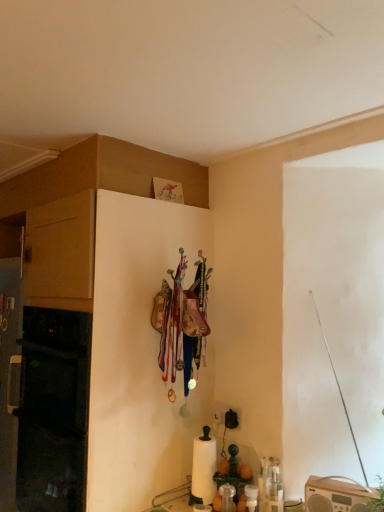
What are the coordinates of `green leafy plant at lower right` in the screenshot? It's located at (378, 498).

Describe the element at coordinates (378, 498) in the screenshot. This screenshot has width=384, height=512. I see `green leafy plant at lower right` at that location.

What do you see at coordinates (102, 175) in the screenshot?
I see `matte wood cabinet at left` at bounding box center [102, 175].

The width and height of the screenshot is (384, 512). What are the coordinates of `matte wood cabinet at left` in the screenshot? It's located at (102, 175).

This screenshot has width=384, height=512. What are the coordinates of `green leafy plant at lower right` in the screenshot? It's located at (378, 498).

Does green leafy plant at lower right appear on the right side of matte wood cabinet at left?

Correct, you'll find green leafy plant at lower right to the right of matte wood cabinet at left.

In the scene shown: Which object is closer to the camera, green leafy plant at lower right or matte wood cabinet at left?

green leafy plant at lower right is closer to the camera.

Consider the image. Which is less distant, (370, 510) or (113, 151)?

The point (370, 510) is in front.

From the image's perspective, which object appears higher, green leafy plant at lower right or matte wood cabinet at left?

matte wood cabinet at left.

From a real-world perspective, between green leafy plant at lower right and matte wood cabinet at left, who is vertically higher?

matte wood cabinet at left, from a real-world perspective.

Can you confirm if green leafy plant at lower right is thinner than matte wood cabinet at left?

Yes.

Which of these two, green leafy plant at lower right or matte wood cabinet at left, stands taller?

matte wood cabinet at left.

Looking at the image, does green leafy plant at lower right seem bigger or smaller compared to matte wood cabinet at left?

In the image, green leafy plant at lower right appears to be smaller than matte wood cabinet at left.

Is green leafy plant at lower right positioned beyond the bounds of matte wood cabinet at left?

Yes, green leafy plant at lower right is outside of matte wood cabinet at left.

Is the surface of green leafy plant at lower right in direct contact with matte wood cabinet at left?

green leafy plant at lower right is not next to matte wood cabinet at left, and they're not touching.

Could you tell me if green leafy plant at lower right is facing matte wood cabinet at left?

No.

How different are the orientations of green leafy plant at lower right and matte wood cabinet at left in degrees?

There is a 33.3-degree angle between the facing directions of green leafy plant at lower right and matte wood cabinet at left.

Where is `plant below the matte wood cabinet at left (from the image's perspective)`? This screenshot has height=512, width=384. plant below the matte wood cabinet at left (from the image's perspective) is located at coordinates (378, 498).

Considering the positions of objects matte wood cabinet at left and green leafy plant at lower right in the image provided, who is more to the right, matte wood cabinet at left or green leafy plant at lower right?

green leafy plant at lower right is more to the right.

Does matte wood cabinet at left come behind green leafy plant at lower right?

Yes, it is.

Which point is more distant from viewer, (35, 187) or (380, 482)?

The point (35, 187) is farther from the camera.

From the image's perspective, which one is positioned lower, matte wood cabinet at left or green leafy plant at lower right?

green leafy plant at lower right is shown below in the image.

From a real-world perspective, which is physically above, matte wood cabinet at left or green leafy plant at lower right?

In real-world perspective, matte wood cabinet at left is above.

Which of these two, matte wood cabinet at left or green leafy plant at lower right, is thinner?

green leafy plant at lower right is thinner.

Does matte wood cabinet at left have a greater height compared to green leafy plant at lower right?

Yes, matte wood cabinet at left is taller than green leafy plant at lower right.

Which of these two, matte wood cabinet at left or green leafy plant at lower right, is smaller?

green leafy plant at lower right is smaller.

Could green leafy plant at lower right be considered to be inside matte wood cabinet at left?

No, green leafy plant at lower right is not a part of matte wood cabinet at left.

Does matte wood cabinet at left touch green leafy plant at lower right?

No, matte wood cabinet at left is not making contact with green leafy plant at lower right.

Is matte wood cabinet at left positioned with its back to green leafy plant at lower right?

No.

Consider the image. How many degrees apart are the facing directions of matte wood cabinet at left and green leafy plant at lower right?

There is a 33.3-degree angle between the facing directions of matte wood cabinet at left and green leafy plant at lower right.

The width and height of the screenshot is (384, 512). What are the coordinates of `cabinetry above the green leafy plant at lower right (from the image's perspective)` in the screenshot? It's located at (102, 175).

Locate an element on the screen. plant below the matte wood cabinet at left (from the image's perspective) is located at coordinates (378, 498).

The height and width of the screenshot is (512, 384). I want to click on plant directly beneath the matte wood cabinet at left (from a real-world perspective), so click(378, 498).